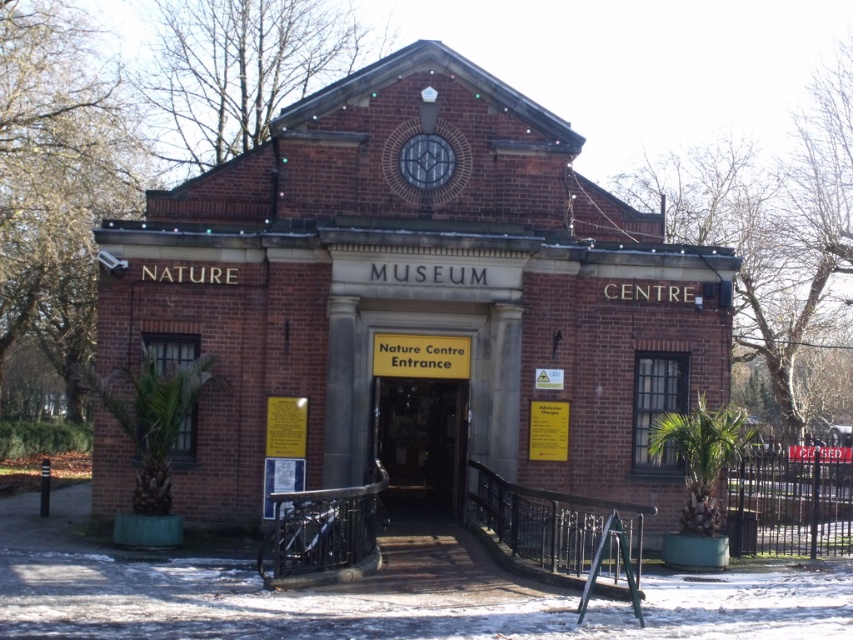
Question: Is brick building at center to the left of wooden door at center from the viewer's perspective?

Choices:
 (A) yes
 (B) no

Answer: (A)

Question: Which point is closer to the camera?

Choices:
 (A) (596, 400)
 (B) (448, 444)

Answer: (A)

Question: Observing the image, what is the correct spatial positioning of brick building at center in reference to wooden door at center?

Choices:
 (A) left
 (B) right

Answer: (A)

Question: Among these objects, which one is nearest to the camera?

Choices:
 (A) brick building at center
 (B) wooden door at center

Answer: (A)

Question: Is brick building at center bigger than wooden door at center?

Choices:
 (A) no
 (B) yes

Answer: (B)